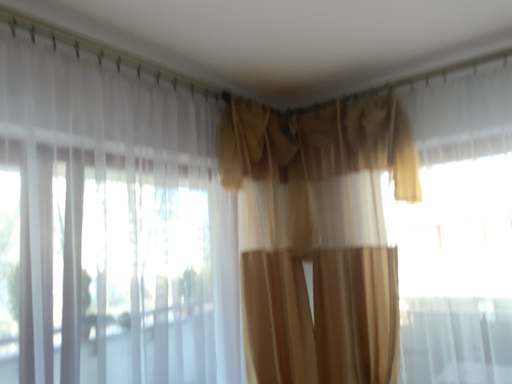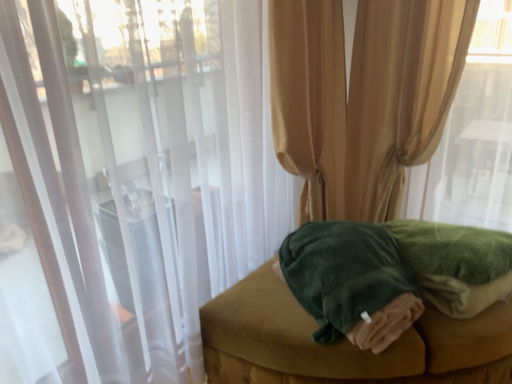
Question: Which way did the camera rotate in the video?

Choices:
 (A) rotated upward
 (B) rotated downward

Answer: (B)